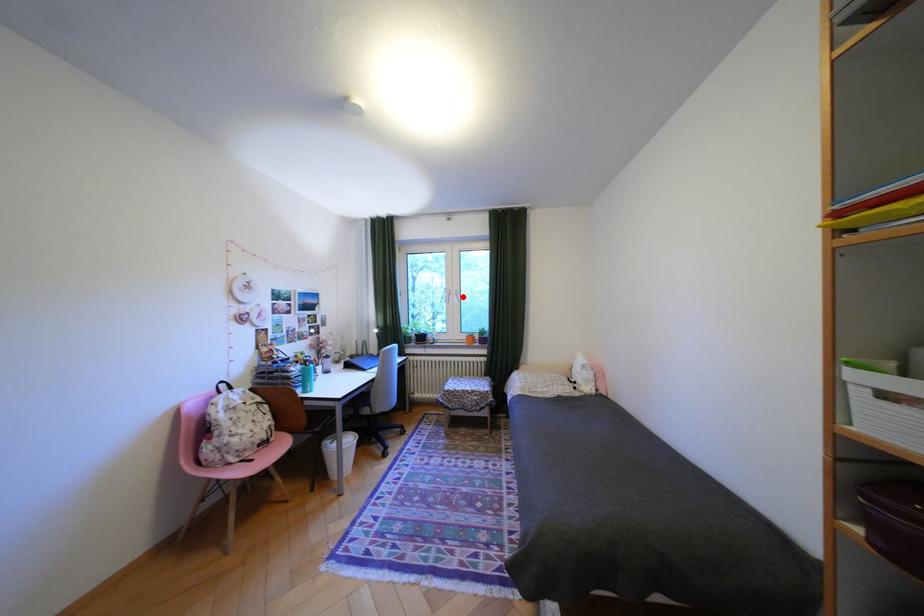
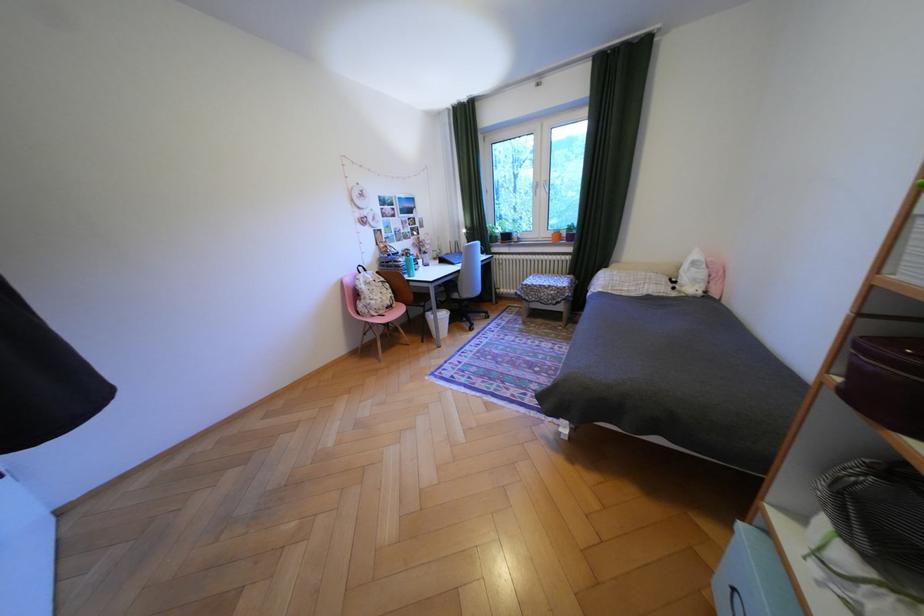
Question: I am providing you with two images of the same scene from different viewpoints. A red point is shown in image1. For the corresponding object point in image2, is it positioned nearer or farther from the camera?

Choices:
 (A) Nearer
 (B) Farther

Answer: (A)